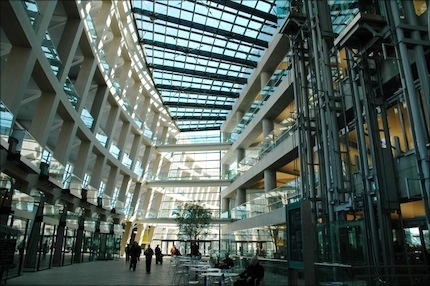
You are a GUI agent. You are given a task and a screenshot of the screen. Output one action in this format:
    pyautogui.click(x=<x>, y=<y>)
    Task: Click on the table
    The height and width of the screenshot is (286, 430).
    Given the screenshot: What is the action you would take?
    pyautogui.click(x=214, y=273)